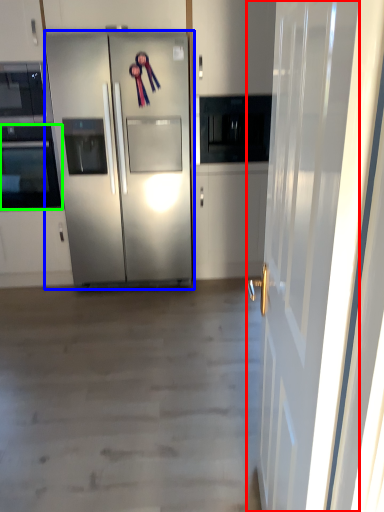
Question: Which is farther away from door (highlighted by a red box)? refrigerator (highlighted by a blue box) or oven (highlighted by a green box)?

Choices:
 (A) refrigerator
 (B) oven

Answer: (B)